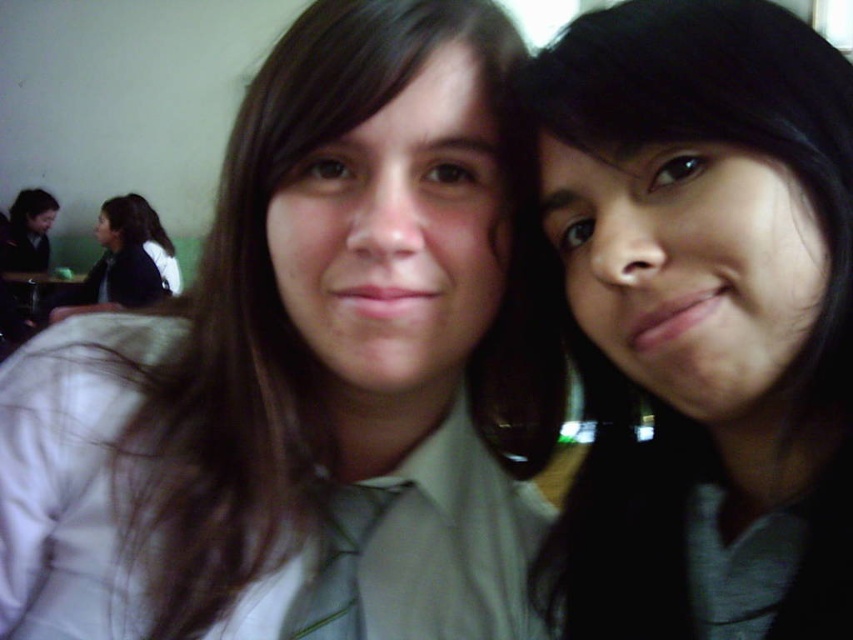
Consider the image. You are taking a photo of two people in a classroom. You notice the green fabric tie at center and the dark brown hair at left. Which object is positioned closer to the camera?

The green fabric tie at center is closer to the viewer than the dark brown hair at left, so the green fabric tie at center is closer to the camera.

You are taking a photo of two people in a classroom. You notice the matte gray shirt at right and the dark brown hair at left. Which object is lower in the image?

The matte gray shirt at right is positioned under dark brown hair at left, so the matte gray shirt at right is lower in the image.

You are taking a selfie with a camera and wearing a matte gray shirt at center. If you want to ensure the camera captures your face clearly, should you move closer to or farther away from the camera?

The matte gray shirt at center and camera are 15.27 inches apart. To ensure the camera captures your face clearly, you should move closer to the camera since the current distance may be too far for clear facial details.